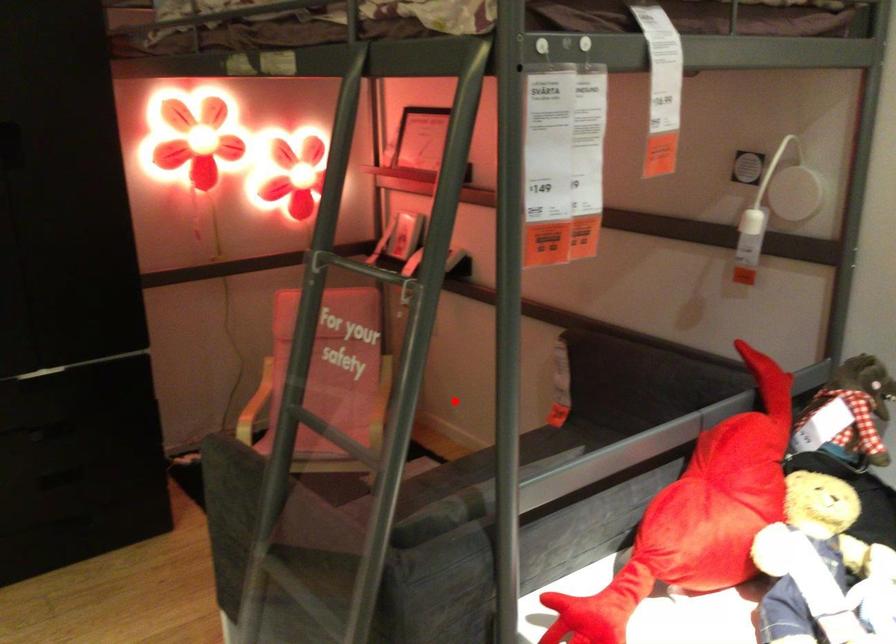
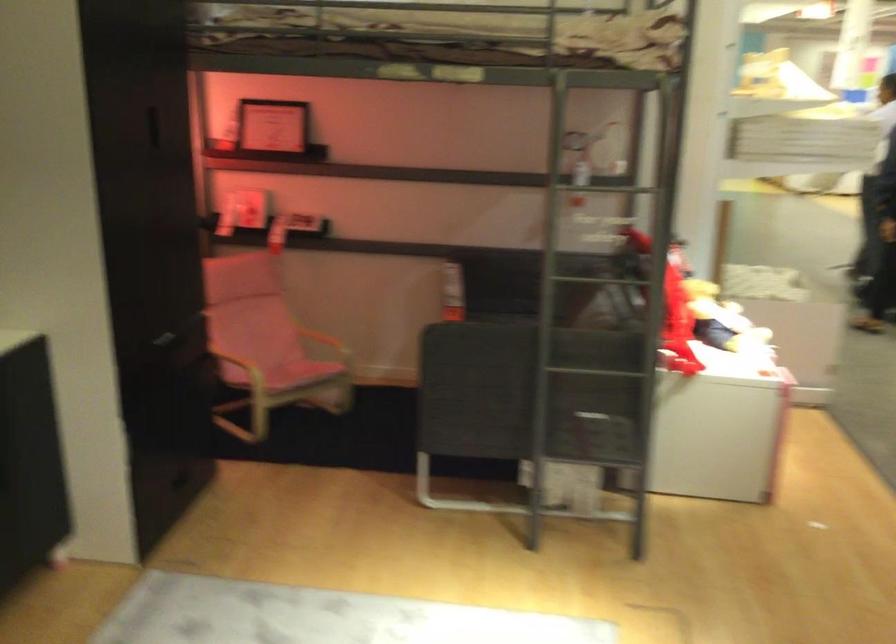
The point at the highlighted location is marked in the first image. Where is the corresponding point in the second image?

(332, 328)